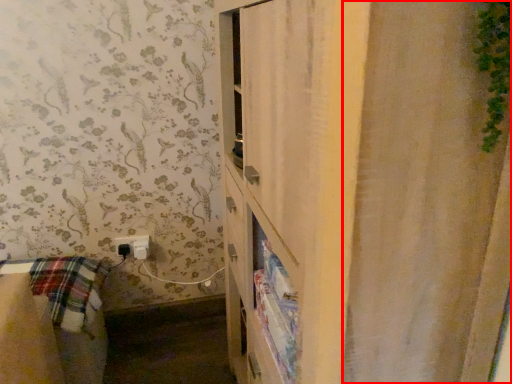
Question: From the image's perspective, where is shower curtain (annotated by the red box) located relative to electric outlet?

Choices:
 (A) below
 (B) above

Answer: (B)